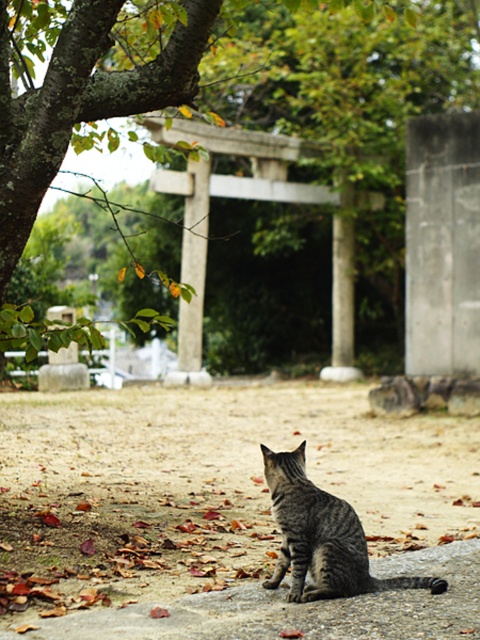
Question: Among these points, which one is nearest to the camera?

Choices:
 (A) (345, 545)
 (B) (441, 369)

Answer: (A)

Question: Which of the following is the farthest from the observer?

Choices:
 (A) (319, 557)
 (B) (433, 305)

Answer: (B)

Question: Is smooth concrete stone at center right in front of gray striped cat at lower center?

Choices:
 (A) yes
 (B) no

Answer: (B)

Question: Is smooth concrete stone at center right to the right of gray striped cat at lower center from the viewer's perspective?

Choices:
 (A) no
 (B) yes

Answer: (B)

Question: Which object is closer to the camera taking this photo?

Choices:
 (A) gray striped cat at lower center
 (B) smooth concrete stone at center right

Answer: (A)

Question: Can you confirm if smooth concrete stone at center right is positioned below gray striped cat at lower center?

Choices:
 (A) no
 (B) yes

Answer: (A)